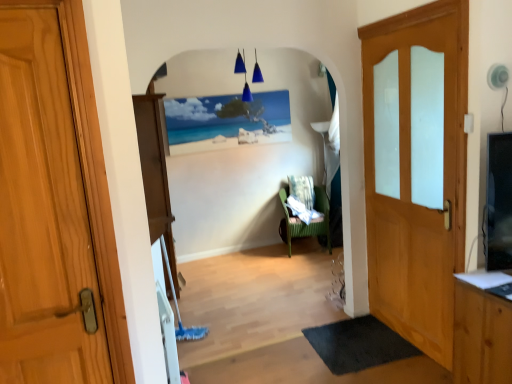
Image resolution: width=512 pixels, height=384 pixels. What do you see at coordinates (311, 222) in the screenshot?
I see `green wicker chair at center` at bounding box center [311, 222].

Describe the element at coordinates (42, 212) in the screenshot. I see `wooden door at left, the 1th door in the left-to-right sequence` at that location.

In order to face wooden door with frosted glass panels at right, placed as the second door when sorted from front to back, should I rotate leftwards or rightwards?

Rotate your view right by about 19.406°.

The width and height of the screenshot is (512, 384). What do you see at coordinates (416, 169) in the screenshot? I see `wooden door with frosted glass panels at right, the 2th door positioned from the left` at bounding box center [416, 169].

Locate an element on the screen. black rubber mat at lower right is located at coordinates (358, 344).

Based on the photo, measure the distance between matte wooden picture frame at center and camera.

The distance of matte wooden picture frame at center from camera is 13.85 feet.

Identify the location of green wicker chair at center. (311, 222).

Which is behind, black rubber mat at lower right or matte wooden picture frame at center?

matte wooden picture frame at center.

Is point (398, 355) less distant than point (194, 99)?

That is True.

From a real-world perspective, who is located lower, black rubber mat at lower right or matte wooden picture frame at center?

black rubber mat at lower right, from a real-world perspective.

Considering the relative sizes of black rubber mat at lower right and matte wooden picture frame at center in the image provided, is black rubber mat at lower right wider than matte wooden picture frame at center?

Yes.

Which of these two, wooden door at left, which is the second door in back-to-front order, or green wicker chair at center, is wider?

green wicker chair at center.

Considering the positions of objects wooden door at left, marked as the 2th door in a right-to-left arrangement, and green wicker chair at center in the image provided, who is in front, wooden door at left, marked as the 2th door in a right-to-left arrangement, or green wicker chair at center?

Positioned in front is wooden door at left, marked as the 2th door in a right-to-left arrangement.

Is there a large distance between wooden door at left, the 1th door in the left-to-right sequence, and green wicker chair at center?

wooden door at left, the 1th door in the left-to-right sequence, is far away from green wicker chair at center.

From a real-world perspective, which is physically above, wooden door at left, marked as the 2th door in a right-to-left arrangement, or green wicker chair at center?

wooden door at left, marked as the 2th door in a right-to-left arrangement.

Which is closer, [195,126] or [381,49]?

Point [195,126] is farther from the camera than point [381,49].

The height and width of the screenshot is (384, 512). Identify the location of door that is the 2nd object directly below the matte wooden picture frame at center (from a real-world perspective). (416, 169).

Which is in front, matte wooden picture frame at center or wooden door with frosted glass panels at right, the 2th door positioned from the left?

wooden door with frosted glass panels at right, the 2th door positioned from the left, is closer to the camera.

From the picture: Can you confirm if matte wooden picture frame at center is smaller than wooden door with frosted glass panels at right, placed as the second door when sorted from front to back?

Correct, matte wooden picture frame at center occupies less space than wooden door with frosted glass panels at right, placed as the second door when sorted from front to back.

The image size is (512, 384). In order to click on door that appears below the wooden door at left, marked as the 2th door in a right-to-left arrangement (from a real-world perspective) in this screenshot , I will do `click(416, 169)`.

Does wooden door at left, marked as the 2th door in a right-to-left arrangement, have a greater height compared to wooden door with frosted glass panels at right, placed as the second door when sorted from front to back?

In fact, wooden door at left, marked as the 2th door in a right-to-left arrangement, may be shorter than wooden door with frosted glass panels at right, placed as the second door when sorted from front to back.

Considering the relative positions of wooden door at left, which is the second door in back-to-front order, and wooden door with frosted glass panels at right, the 1th door in the right-to-left sequence, in the image provided, is wooden door at left, which is the second door in back-to-front order, to the left of wooden door with frosted glass panels at right, the 1th door in the right-to-left sequence, from the viewer's perspective?

Correct, you'll find wooden door at left, which is the second door in back-to-front order, to the left of wooden door with frosted glass panels at right, the 1th door in the right-to-left sequence.

Which is nearer, (35, 138) or (465, 31)?

Clearly, point (35, 138) is closer to the camera than point (465, 31).

Locate an element on the screen. chair on the right of the matte wooden picture frame at center is located at coordinates (311, 222).

Is green wicker chair at center looking in the opposite direction of matte wooden picture frame at center?

No, green wicker chair at center is not facing away from matte wooden picture frame at center.

From a real-world perspective, who is located lower, green wicker chair at center or matte wooden picture frame at center?

From a 3D spatial view, green wicker chair at center is below.

Which is more to the right, green wicker chair at center or matte wooden picture frame at center?

From the viewer's perspective, green wicker chair at center appears more on the right side.

From the image's perspective, is matte wooden picture frame at center positioned above or below wooden door at left, the 1th door in the left-to-right sequence?

Based on their image positions, matte wooden picture frame at center is located above wooden door at left, the 1th door in the left-to-right sequence.

Is matte wooden picture frame at center surrounding wooden door at left, marked as the 2th door in a right-to-left arrangement?

No.

Considering the positions of objects matte wooden picture frame at center and wooden door at left, placed as the first door when sorted from front to back, in the image provided, who is more to the left, matte wooden picture frame at center or wooden door at left, placed as the first door when sorted from front to back,?

From the viewer's perspective, wooden door at left, placed as the first door when sorted from front to back, appears more on the left side.

This screenshot has height=384, width=512. Find the location of `picture frame that appears above the wooden door at left, placed as the first door when sorted from front to back (from a real-world perspective)`. picture frame that appears above the wooden door at left, placed as the first door when sorted from front to back (from a real-world perspective) is located at coordinates (226, 121).

Image resolution: width=512 pixels, height=384 pixels. What are the coordinates of `picture frame on the right of the wooden door at left, marked as the 2th door in a right-to-left arrangement` in the screenshot? It's located at (226, 121).

From a real-world perspective, which is physically above, wooden door at left, the 1th door in the left-to-right sequence, or matte wooden picture frame at center?

matte wooden picture frame at center, from a real-world perspective.

Considering the points (53, 39) and (247, 112), which point is behind, point (53, 39) or point (247, 112)?

The point (247, 112) is farther.

You are a GUI agent. You are given a task and a screenshot of the screen. Output one action in this format:
    pyautogui.click(x=<x>, y=<y>)
    Task: Click on the picture frame above the black rubber mat at lower right (from a real-world perspective)
    The image size is (512, 384).
    Given the screenshot: What is the action you would take?
    pyautogui.click(x=226, y=121)

At what (x,y) coordinates should I click in order to perform the action: click on chair behind the wooden door at left, marked as the 2th door in a right-to-left arrangement. Please return your answer as a coordinate pair (x, y). Looking at the image, I should click on (311, 222).

Which object lies nearer to the anchor point wooden door with frosted glass panels at right, the 1th door in the right-to-left sequence, black rubber mat at lower right or wooden door at left, placed as the first door when sorted from front to back?

Among the two, black rubber mat at lower right is located nearer to wooden door with frosted glass panels at right, the 1th door in the right-to-left sequence.

Considering their positions, is wooden door at left, marked as the 2th door in a right-to-left arrangement, positioned further to black rubber mat at lower right than wooden door with frosted glass panels at right, the 2th door positioned from the left?

Based on the image, wooden door at left, marked as the 2th door in a right-to-left arrangement, appears to be further to black rubber mat at lower right.

Based on their spatial positions, is matte wooden picture frame at center or wooden door at left, the 1th door in the left-to-right sequence, closer to wooden door with frosted glass panels at right, the 2th door positioned from the left?

wooden door at left, the 1th door in the left-to-right sequence, is closer to wooden door with frosted glass panels at right, the 2th door positioned from the left.

From the image, which object appears to be nearer to matte wooden picture frame at center, wooden door at left, the 1th door in the left-to-right sequence, or green wicker chair at center?

Based on the image, green wicker chair at center appears to be nearer to matte wooden picture frame at center.

Based on the photo, when comparing their distances from black rubber mat at lower right, does green wicker chair at center or matte wooden picture frame at center seem closer?

green wicker chair at center is closer to black rubber mat at lower right.

Based on their spatial positions, is black rubber mat at lower right or wooden door with frosted glass panels at right, the 2th door positioned from the left, further from wooden door at left, marked as the 2th door in a right-to-left arrangement?

The object further to wooden door at left, marked as the 2th door in a right-to-left arrangement, is wooden door with frosted glass panels at right, the 2th door positioned from the left.

From the image, which object appears to be nearer to black rubber mat at lower right, matte wooden picture frame at center or green wicker chair at center?

green wicker chair at center lies closer to black rubber mat at lower right than the other object.

Based on their spatial positions, is black rubber mat at lower right or matte wooden picture frame at center closer to wooden door with frosted glass panels at right, placed as the second door when sorted from front to back?

The object closer to wooden door with frosted glass panels at right, placed as the second door when sorted from front to back, is black rubber mat at lower right.

Where is `door positioned between wooden door at left, which is the second door in back-to-front order, and matte wooden picture frame at center from near to far`? door positioned between wooden door at left, which is the second door in back-to-front order, and matte wooden picture frame at center from near to far is located at coordinates (416, 169).

This screenshot has width=512, height=384. I want to click on flat between wooden door at left, which is the second door in back-to-front order, and green wicker chair at center in the front-back direction, so click(x=358, y=344).

Find the location of `picture frame between wooden door with frosted glass panels at right, the 2th door positioned from the left, and green wicker chair at center in the front-back direction`. picture frame between wooden door with frosted glass panels at right, the 2th door positioned from the left, and green wicker chair at center in the front-back direction is located at coordinates (226, 121).

Locate an element on the screen. The height and width of the screenshot is (384, 512). picture frame between black rubber mat at lower right and green wicker chair at center in the front-back direction is located at coordinates (226, 121).